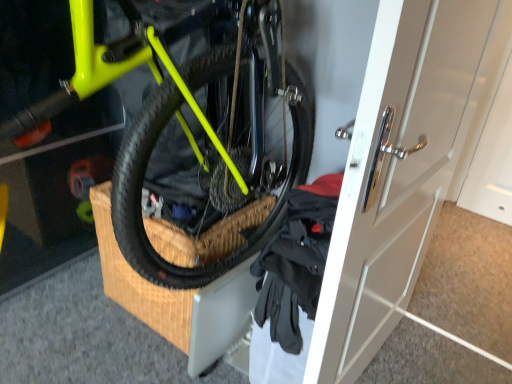
At what (x,y) coordinates should I click in order to perform the action: click on vacant area located to the right-hand side of white glossy door at center. Please return your answer as a coordinate pair (x, y). This screenshot has height=384, width=512. Looking at the image, I should click on (426, 360).